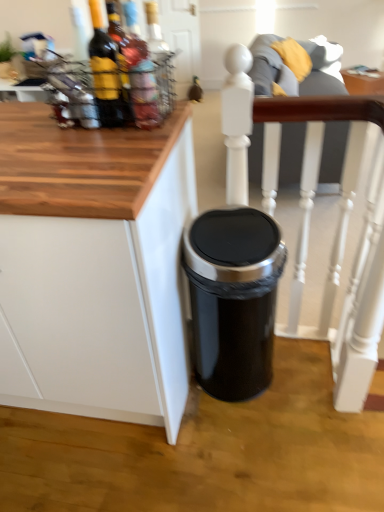
This screenshot has width=384, height=512. What are the coordinates of `free space above black metallic trash can at center (from a real-world perspective)` in the screenshot? It's located at (234, 226).